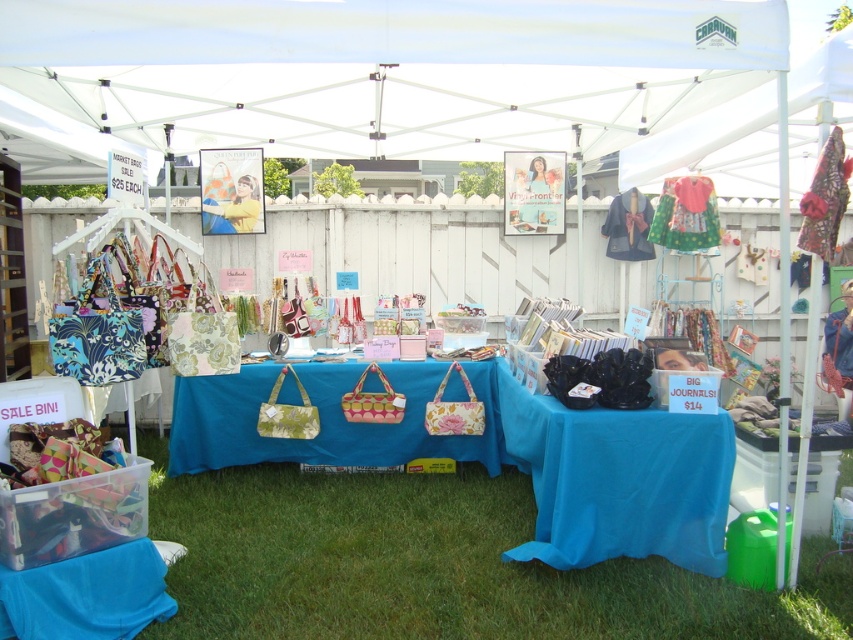
Question: Which of the following is the closest to the observer?

Choices:
 (A) (430, 436)
 (B) (628, 435)
 (C) (534, 48)
 (D) (598, 580)

Answer: (C)

Question: Which of the following is the closest to the observer?

Choices:
 (A) white fabric canopy at upper center
 (B) green grass at lower center

Answer: (B)

Question: Can you confirm if green grass at lower center is thinner than blue fabric table at center?

Choices:
 (A) no
 (B) yes

Answer: (A)

Question: In this image, where is white fabric canopy at upper center located relative to blue fabric table at center?

Choices:
 (A) above
 (B) below

Answer: (A)

Question: Is white fabric canopy at upper center to the left of floral fabric handbags at center from the viewer's perspective?

Choices:
 (A) no
 (B) yes

Answer: (A)

Question: Which of the following is the closest to the observer?

Choices:
 (A) (378, 480)
 (B) (335, 390)
 (C) (132, 122)

Answer: (B)